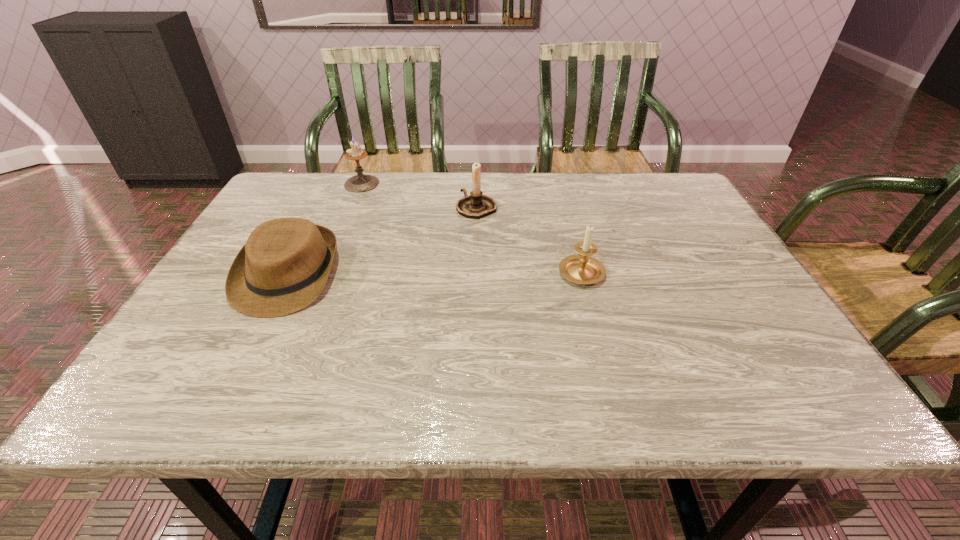
Find the location of `vacant region between the farthest candle holder and the rightmost object`. vacant region between the farthest candle holder and the rightmost object is located at coordinates (471, 227).

The width and height of the screenshot is (960, 540). I want to click on empty location between the farthest object and the second candle holder from left to right, so click(x=420, y=195).

Identify the location of free point between the fedora and the second object from right to left. The width and height of the screenshot is (960, 540). (382, 241).

Find the location of `blank region between the third object from left to right and the farthest object`. blank region between the third object from left to right and the farthest object is located at coordinates (420, 195).

This screenshot has width=960, height=540. What are the coordinates of `free space between the second candle holder from left to right and the leftmost candle holder` in the screenshot? It's located at (420, 195).

You are a GUI agent. You are given a task and a screenshot of the screen. Output one action in this format:
    pyautogui.click(x=<x>, y=<y>)
    Task: Click on the free space between the shortest object and the second candle holder from right to left
    
    Given the screenshot: What is the action you would take?
    pyautogui.click(x=382, y=241)

Locate an element on the screen. This screenshot has width=960, height=540. empty space between the second nearest candle holder and the shortest object is located at coordinates point(382,241).

Image resolution: width=960 pixels, height=540 pixels. What are the coordinates of `vacant space that's between the third object from left to right and the leftmost candle holder` in the screenshot? It's located at (420, 195).

I want to click on free space between the leftmost candle holder and the rightmost candle holder, so click(x=471, y=227).

The width and height of the screenshot is (960, 540). Find the location of `blank region between the second nearest candle holder and the rightmost object`. blank region between the second nearest candle holder and the rightmost object is located at coordinates (529, 239).